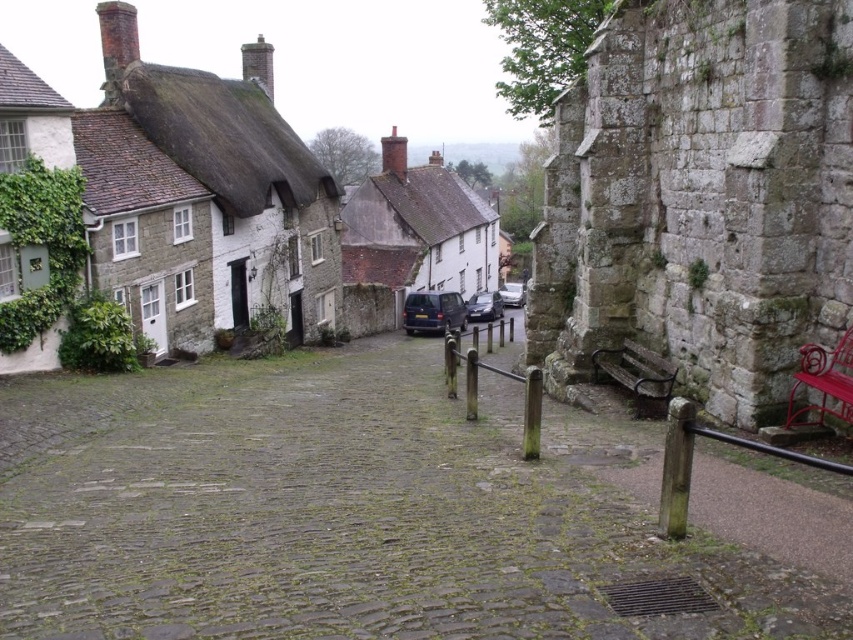
Is the position of red wrought iron bench at right less distant than that of dark blue metallic van at center?

Yes, it is in front of dark blue metallic van at center.

Which is in front, point (821, 397) or point (456, 307)?

Point (821, 397) is in front.

Between point (824, 376) and point (421, 307), which one is positioned behind?

Point (421, 307)

Image resolution: width=853 pixels, height=640 pixels. I want to click on red wrought iron bench at right, so click(x=824, y=381).

Does white matte cottage at center come in front of metallic silver car at center?

Yes, white matte cottage at center is in front of metallic silver car at center.

Is white matte cottage at center below metallic silver car at center?

Actually, white matte cottage at center is above metallic silver car at center.

Find the location of `white matte cottage at center`. white matte cottage at center is located at coordinates (416, 228).

I want to click on white matte cottage at center, so click(416, 228).

The height and width of the screenshot is (640, 853). Describe the element at coordinates (228, 173) in the screenshot. I see `stone thatched cottage at left` at that location.

Is stone thatched cottage at left to the left of metallic silver car at center from the viewer's perspective?

Correct, you'll find stone thatched cottage at left to the left of metallic silver car at center.

Describe the element at coordinates (228, 173) in the screenshot. The image size is (853, 640). I see `stone thatched cottage at left` at that location.

Where is `stone thatched cottage at left`? This screenshot has height=640, width=853. stone thatched cottage at left is located at coordinates (228, 173).